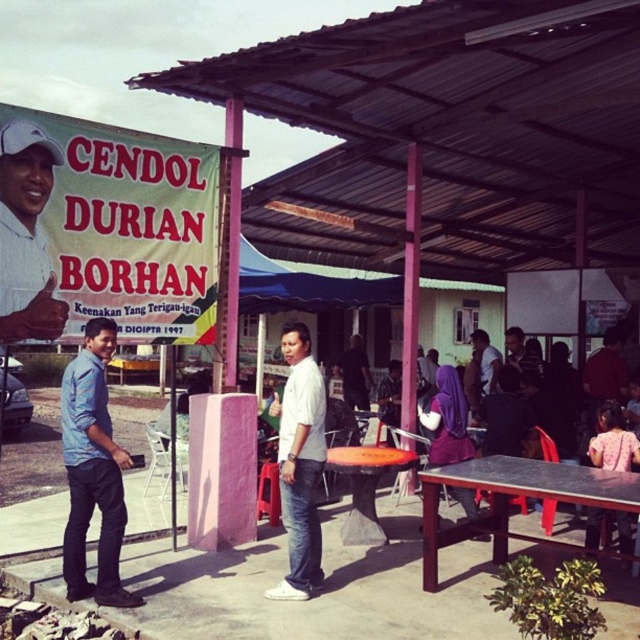
Which is above, black laminate table at lower right or matte white shirt at upper left?

matte white shirt at upper left

Does black laminate table at lower right lie in front of matte white shirt at upper left?

Yes.

Which is behind, point (428, 468) or point (6, 340)?

The point (428, 468) is behind.

In order to click on black laminate table at lower right in this screenshot , I will do `click(518, 493)`.

Who is lower down, black laminate table at lower right or orange plastic table at center?

black laminate table at lower right is lower down.

Identify the location of black laminate table at lower right. (518, 493).

At what (x,y) coordinates should I click in order to perform the action: click on black laminate table at lower right. Please return your answer as a coordinate pair (x, y). The width and height of the screenshot is (640, 640). Looking at the image, I should click on (518, 493).

At what (x,y) coordinates should I click in order to perform the action: click on black laminate table at lower right. Please return your answer as a coordinate pair (x, y). The image size is (640, 640). Looking at the image, I should click on (518, 493).

Can you confirm if black laminate table at lower right is smaller than pink fabric dress at lower right?

No.

Between black laminate table at lower right and pink fabric dress at lower right, which one appears on the right side from the viewer's perspective?

pink fabric dress at lower right is more to the right.

Image resolution: width=640 pixels, height=640 pixels. Find the location of `black laminate table at lower right`. black laminate table at lower right is located at coordinates (518, 493).

Where is `black laminate table at lower right`? This screenshot has height=640, width=640. black laminate table at lower right is located at coordinates (518, 493).